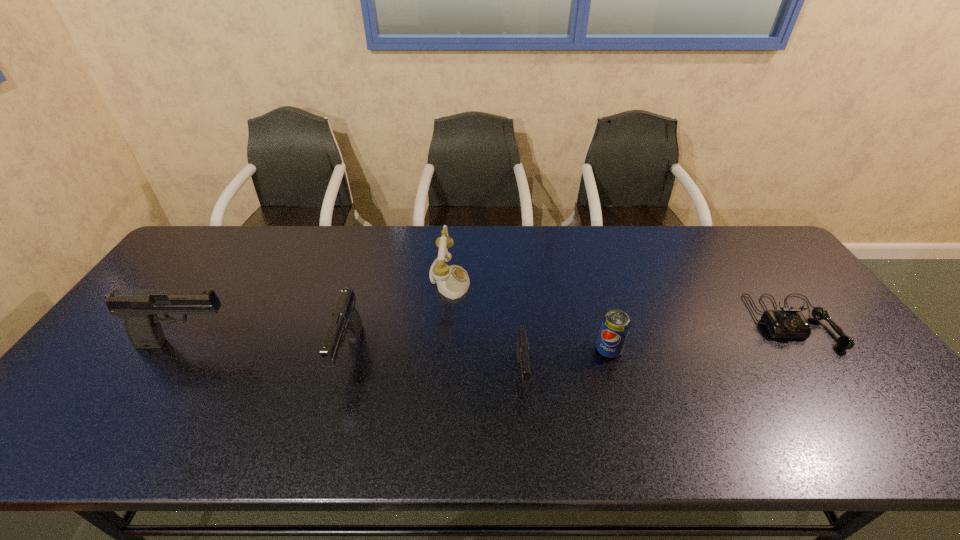
With all pistols evenly spaced, where should an extra pistol be placed on the right to continue the pattern? Please point out a vacant space. Please provide its 2D coordinates. Your answer should be formatted as a tuple, i.e. [(x, y)], where the tuple contains the x and y coordinates of a point satisfying the conditions above.

[(708, 392)]